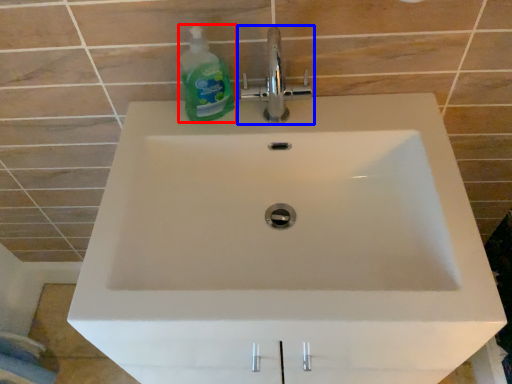
Question: Which object is further to the camera taking this photo, cleaning product (highlighted by a red box) or tap (highlighted by a blue box)?

Choices:
 (A) cleaning product
 (B) tap

Answer: (B)